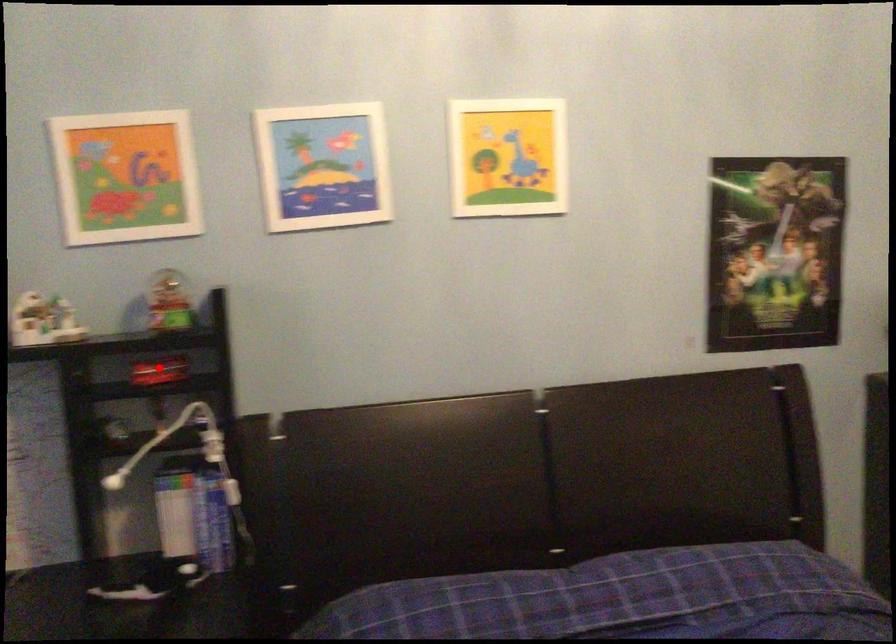
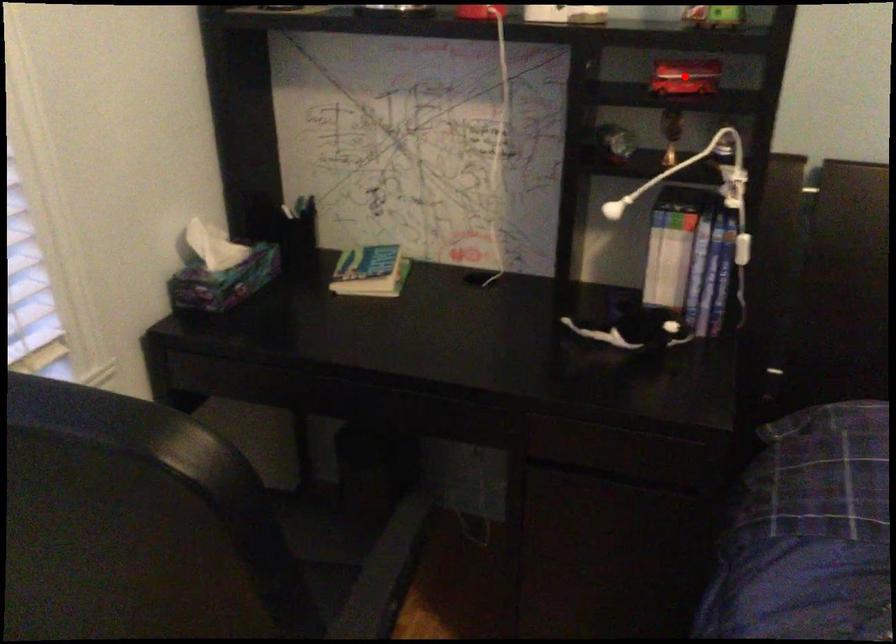
I am providing you with two images of the same scene from different viewpoints. A red point is marked on the first image and another point is marked on the second image. Are the points marked in image1 and image2 representing the same 3D position?

Yes